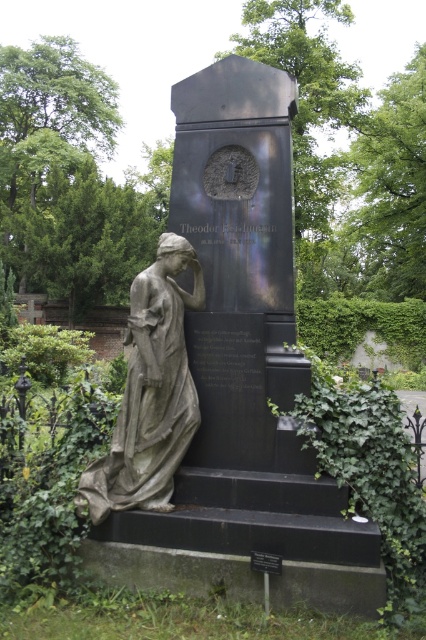
Question: Which point is closer to the camera taking this photo?

Choices:
 (A) (201, 524)
 (B) (192, 257)

Answer: (A)

Question: Among these objects, which one is nearest to the camera?

Choices:
 (A) gray stone statue at center
 (B) gray stone statue at left

Answer: (B)

Question: Which point is closer to the camera?

Choices:
 (A) (180, 355)
 (B) (135, 561)

Answer: (B)

Question: Observing the image, what is the correct spatial positioning of gray stone statue at center in reference to gray stone statue at left?

Choices:
 (A) right
 (B) left

Answer: (A)

Question: Where is gray stone statue at center located in relation to gray stone statue at left in the image?

Choices:
 (A) above
 (B) below

Answer: (A)

Question: Observing the image, what is the correct spatial positioning of gray stone statue at center in reference to gray stone statue at left?

Choices:
 (A) above
 (B) below

Answer: (A)